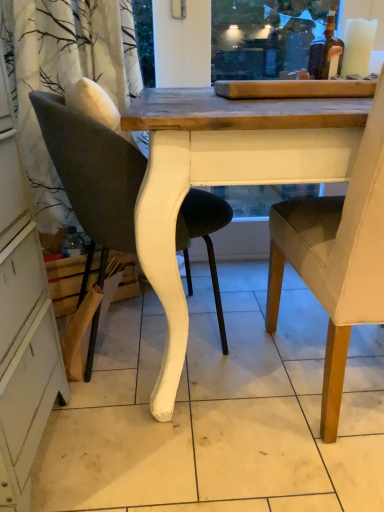
Question: From a real-world perspective, is light brown fabric chair at right, which is the 1th chair in right-to-left order, above or below white painted wood chair at left, the 2th chair viewed from the right?

Choices:
 (A) above
 (B) below

Answer: (A)

Question: Looking at their shapes, would you say light brown fabric chair at right, the 2th chair in the left-to-right sequence, is wider or thinner than white painted wood chair at left, the 2th chair viewed from the right?

Choices:
 (A) wide
 (B) thin

Answer: (A)

Question: From the image's perspective, is light brown fabric chair at right, which is the 1th chair in right-to-left order, positioned above or below white painted wood chair at left, the 2th chair viewed from the right?

Choices:
 (A) above
 (B) below

Answer: (B)

Question: From a real-world perspective, is white painted wood chair at left, which is the 1th chair in left-to-right order, above or below light brown fabric chair at right, the 2th chair in the left-to-right sequence?

Choices:
 (A) below
 (B) above

Answer: (A)

Question: Considering the positions of white painted wood chair at left, the 2th chair viewed from the right, and light brown fabric chair at right, the 2th chair in the left-to-right sequence, in the image, is white painted wood chair at left, the 2th chair viewed from the right, bigger or smaller than light brown fabric chair at right, the 2th chair in the left-to-right sequence,?

Choices:
 (A) small
 (B) big

Answer: (A)

Question: Is white painted wood chair at left, which is the 1th chair in left-to-right order, in front of or behind light brown fabric chair at right, which is the 1th chair in right-to-left order, in the image?

Choices:
 (A) behind
 (B) front

Answer: (A)

Question: Considering the positions of white painted wood chair at left, the 2th chair viewed from the right, and light brown fabric chair at right, which is the 1th chair in right-to-left order, in the image, is white painted wood chair at left, the 2th chair viewed from the right, wider or thinner than light brown fabric chair at right, which is the 1th chair in right-to-left order,?

Choices:
 (A) thin
 (B) wide

Answer: (A)